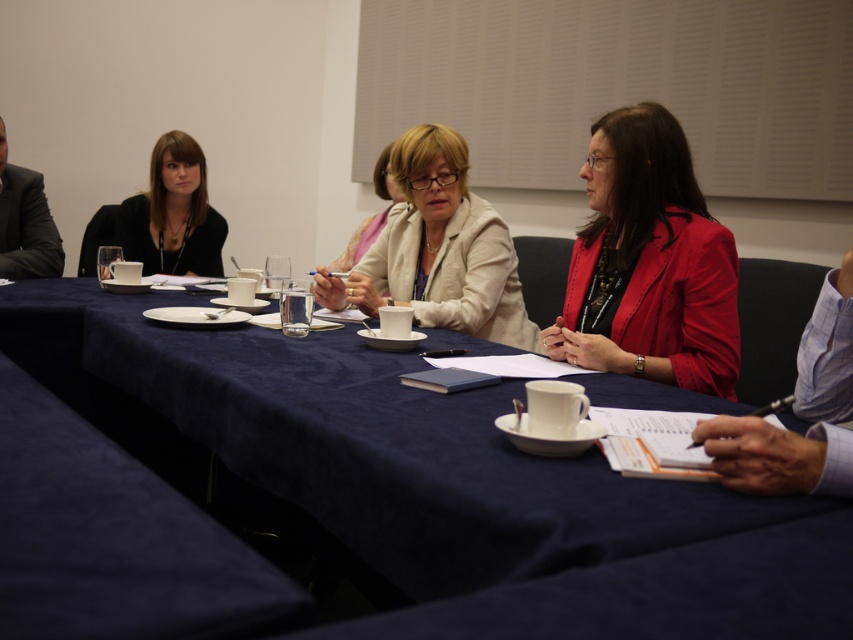
You are sitting at the back of the conference room and want to pass a document to the person wearing the matte beige jacket at center. The blue fabric table at center is in your way. Can you reach the person without moving around the table?

The blue fabric table at center is closer to the viewer than matte beige jacket at center, so you can reach the person wearing the matte beige jacket at center by passing the document over the blue fabric table at center since it is between you and them.

You are a person sitting at the blue fabric table at center. You need to pass a document to the person wearing the matte red blazer at center. Can you reach them without leaving your seat?

The blue fabric table at center and the matte red blazer at center are 20.44 inches apart from each other. Since this distance is relatively short, you can likely reach the person wearing the matte red blazer at center without leaving your seat.